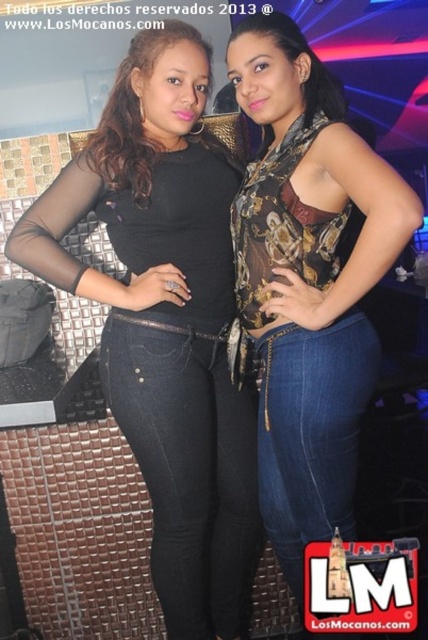
Can you confirm if matte black top at center is positioned to the right of printed fabric top at center?

In fact, matte black top at center is to the left of printed fabric top at center.

The image size is (428, 640). Describe the element at coordinates (166, 321) in the screenshot. I see `matte black top at center` at that location.

This screenshot has width=428, height=640. In order to click on matte black top at center in this screenshot , I will do `click(166, 321)`.